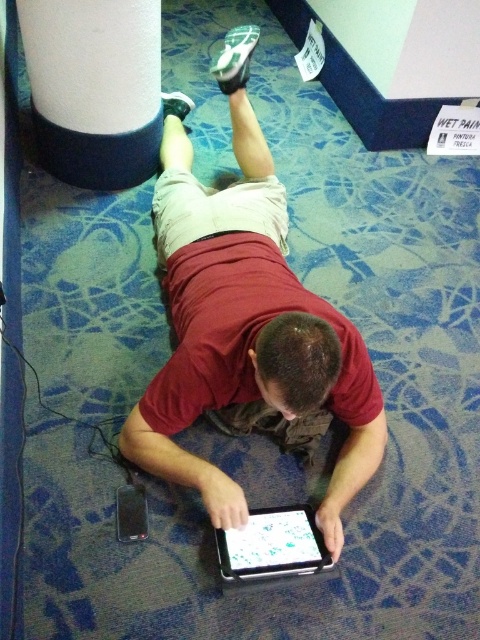
You are standing in a room and want to reach a specific point marked at coordinates [178,182]. If you are currently 1.5 meters away from that point, how much further do you need to move forward to reach it?

The distance of point [178,182] from camera is 1.86 meters. Since you are currently 1.5 meters away, you need to move forward an additional 0.36 meters to reach the point.

You are a delivery person who just arrived at a house. You see the white matte cylinder at upper left and the black glossy tablet at center. Which object is bigger?

The white matte cylinder at upper left is larger in size than the black glossy tablet at center.